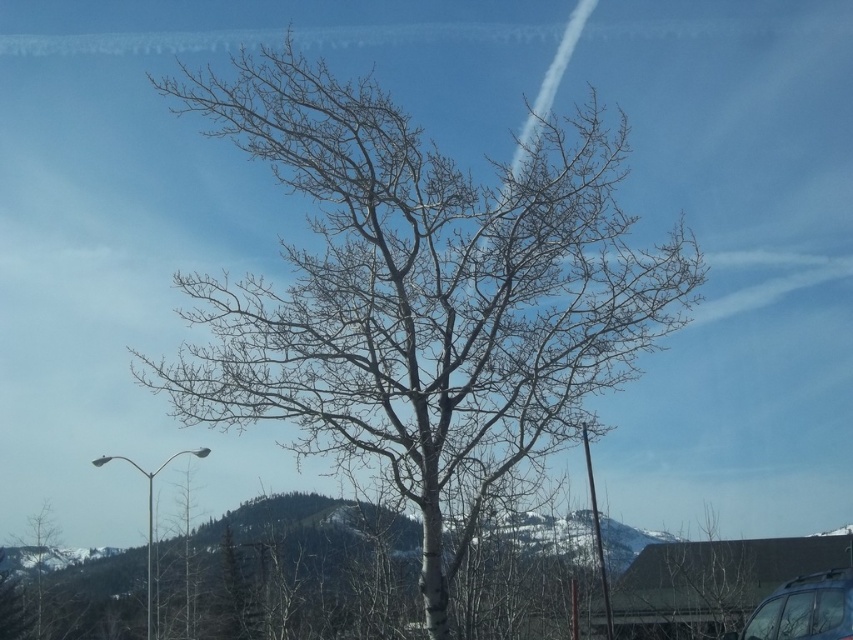
Consider the image. Can you confirm if transparent glass car window at center is wider than transparent glass car window at lower right?

Incorrect, transparent glass car window at center's width does not surpass transparent glass car window at lower right's.

Can you confirm if transparent glass car window at center is thinner than transparent glass car window at lower right?

Yes, transparent glass car window at center is thinner than transparent glass car window at lower right.

Between point (827, 611) and point (764, 625), which one is positioned in front?

Point (827, 611) is in front.

The width and height of the screenshot is (853, 640). In order to click on transparent glass car window at center in this screenshot , I will do `click(830, 612)`.

Between bare wood tree at lower left and transparent glass car window at lower right, which one appears on the left side from the viewer's perspective?

Positioned to the left is bare wood tree at lower left.

Is bare wood tree at lower left to the right of transparent glass car window at lower right from the viewer's perspective?

In fact, bare wood tree at lower left is to the left of transparent glass car window at lower right.

What do you see at coordinates (41, 552) in the screenshot? I see `bare wood tree at lower left` at bounding box center [41, 552].

The width and height of the screenshot is (853, 640). Identify the location of bare wood tree at lower left. (41, 552).

Does point (505, 413) come closer to viewer compared to point (756, 612)?

Yes, it is in front of point (756, 612).

Is point (573, 272) positioned behind point (769, 612)?

No, it is in front of (769, 612).

Locate an element on the screen. Image resolution: width=853 pixels, height=640 pixels. bare wood tree at center is located at coordinates (422, 296).